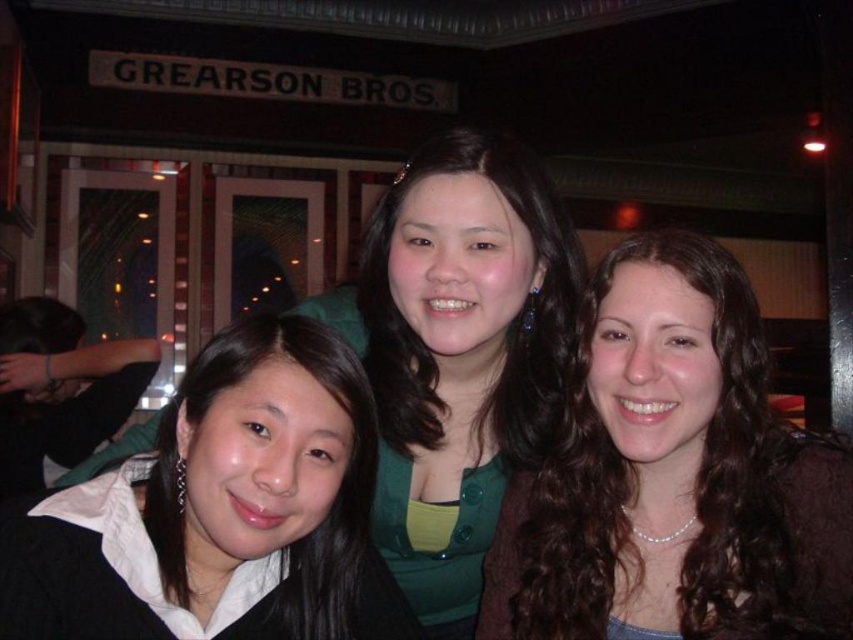
How far apart are brown curly hair at center and matte black jacket at lower left?

14.38 inches

Is point (639, 417) more distant than point (45, 515)?

No, it is not.

You are a GUI agent. You are given a task and a screenshot of the screen. Output one action in this format:
    pyautogui.click(x=<x>, y=<y>)
    Task: Click on the brown curly hair at center
    This screenshot has height=640, width=853.
    Given the screenshot: What is the action you would take?
    pyautogui.click(x=674, y=476)

Can you confirm if matte black jacket at lower left is positioned below green matte shirt at center?

Yes, matte black jacket at lower left is below green matte shirt at center.

Where is `matte black jacket at lower left`? matte black jacket at lower left is located at coordinates (219, 512).

Locate an element on the screen. The width and height of the screenshot is (853, 640). brown curly hair at center is located at coordinates (674, 476).

Based on the photo, who is more forward, (753, 486) or (405, 461)?

Point (753, 486) is more forward.

Who is more forward, (x=741, y=600) or (x=537, y=280)?

Positioned in front is point (x=741, y=600).

Locate an element on the screen. brown curly hair at center is located at coordinates (674, 476).